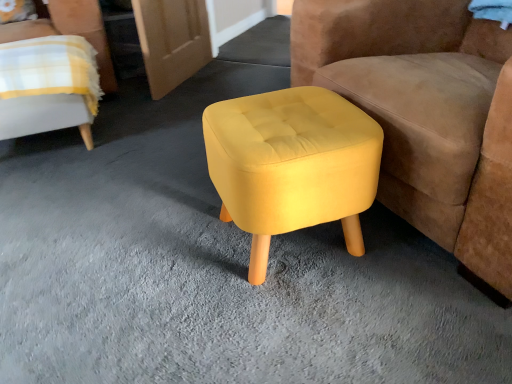
Where is `free spot in front of yellow fabric stool at center`? The image size is (512, 384). free spot in front of yellow fabric stool at center is located at coordinates (338, 331).